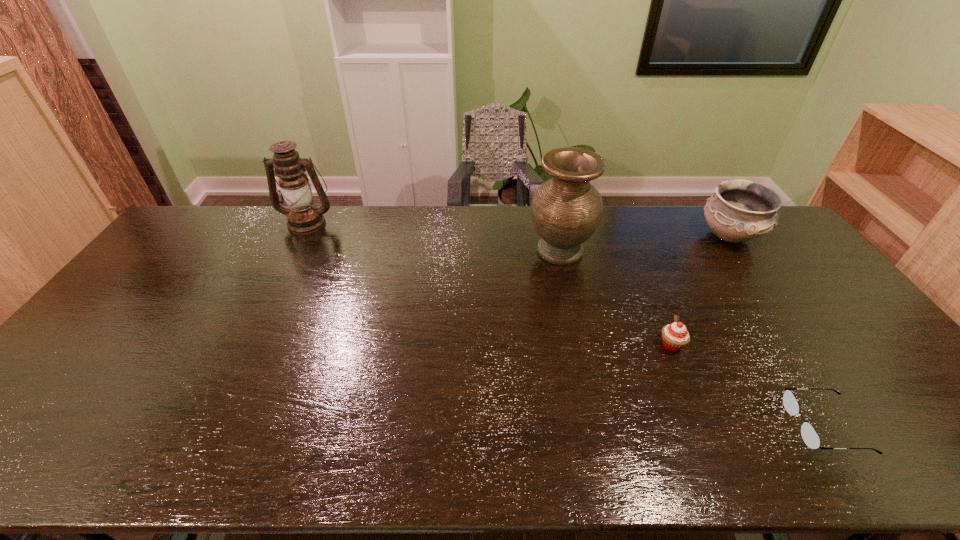
Where is `the second object from left to right`? The image size is (960, 540). the second object from left to right is located at coordinates (566, 210).

Locate an element on the screen. This screenshot has height=540, width=960. the leftmost object is located at coordinates (303, 218).

Find the location of a particular element. This screenshot has height=540, width=960. the third tallest object is located at coordinates (740, 210).

At what (x,y) coordinates should I click in order to perform the action: click on the fourth tallest object. Please return your answer as a coordinate pair (x, y). Looking at the image, I should click on (675, 336).

The image size is (960, 540). Identify the location of the third object from left to right. (675, 336).

Find the location of a particular element. spectacles is located at coordinates click(x=809, y=435).

You are a GUI agent. You are given a task and a screenshot of the screen. Output one action in this format:
    pyautogui.click(x=<x>, y=<y>)
    Task: Click on the shortest object
    The image size is (960, 540).
    Given the screenshot: What is the action you would take?
    pyautogui.click(x=809, y=435)

The image size is (960, 540). I want to click on blank space located 0.270m on the left of the second object from left to right, so pos(447,251).

This screenshot has height=540, width=960. What are the coordinates of `vacant space located 0.390m on the right of the lantern` in the screenshot? It's located at (442, 222).

Locate an element on the screen. The image size is (960, 540). vacant space located 0.360m on the front of the pottery is located at coordinates (803, 340).